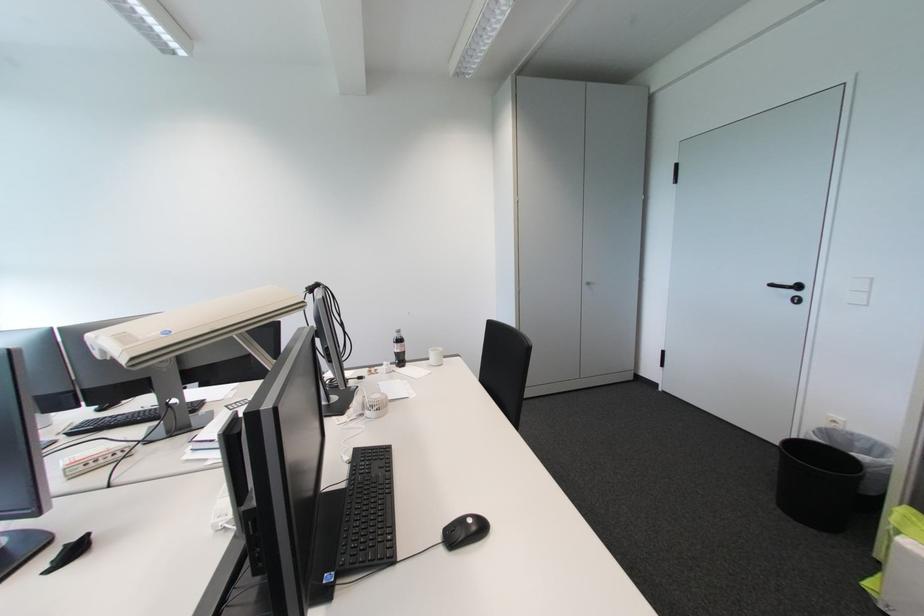
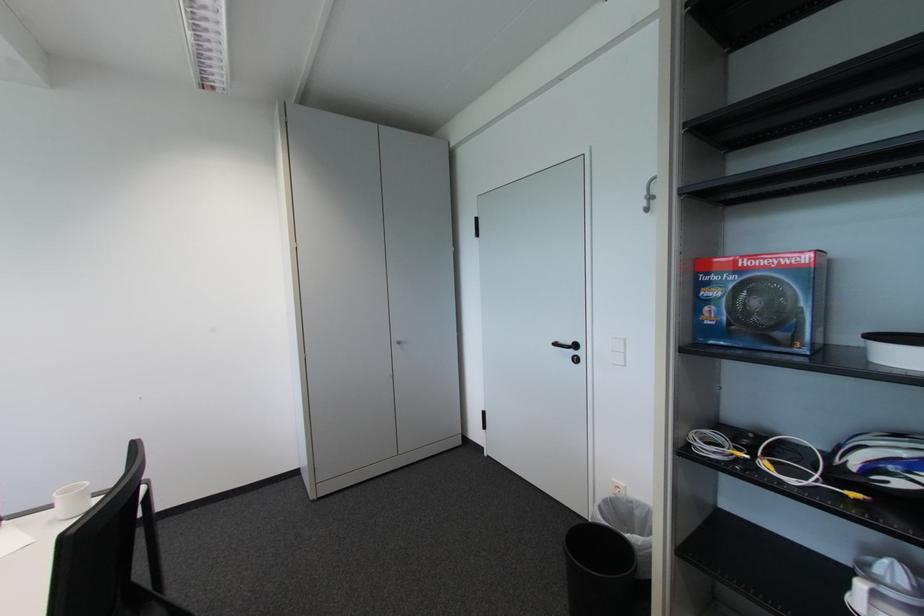
What movement of the cameraman would produce the second image?

The cameraman moved toward right, forward.